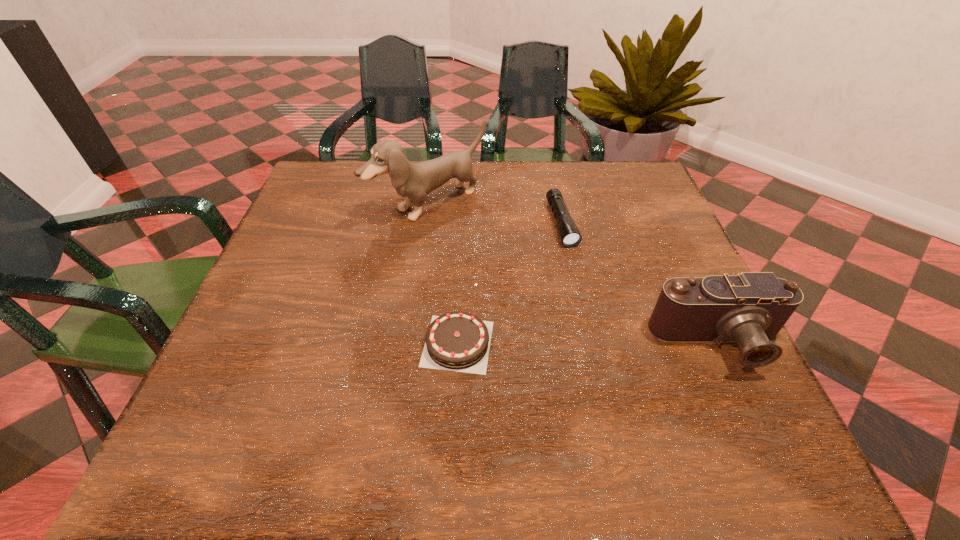
Locate an element on the screen. The image size is (960, 540). chocolate cake is located at coordinates (457, 341).

You are a GUI agent. You are given a task and a screenshot of the screen. Output one action in this format:
    pyautogui.click(x=<x>, y=<y>)
    Task: Click on the camera
    The width and height of the screenshot is (960, 540).
    Given the screenshot: What is the action you would take?
    pyautogui.click(x=750, y=308)

Find the location of a particular element. This screenshot has width=960, height=540. the rightmost object is located at coordinates (750, 308).

Image resolution: width=960 pixels, height=540 pixels. Find the location of `puppy`. puppy is located at coordinates (413, 182).

Where is `the second object from right to left`? The image size is (960, 540). the second object from right to left is located at coordinates (570, 236).

At what (x,y) coordinates should I click in order to perform the action: click on free space located 0.080m on the right of the chocolate cake. Please return your answer as a coordinate pair (x, y). The height and width of the screenshot is (540, 960). Looking at the image, I should click on (537, 343).

Locate an element on the screen. The width and height of the screenshot is (960, 540). vacant area located at the face of the puppy is located at coordinates (588, 329).

Where is `vacant region located at the face of the puppy`? vacant region located at the face of the puppy is located at coordinates (506, 262).

You are a GUI agent. You are given a task and a screenshot of the screen. Output one action in this format:
    pyautogui.click(x=<x>, y=<y>)
    Task: Click on the blank space located 0.160m at the face of the puppy
    
    Given the screenshot: What is the action you would take?
    pyautogui.click(x=506, y=262)

Identify the location of vacant area situated at the lens end of the third object from left to right. The width and height of the screenshot is (960, 540). (618, 376).